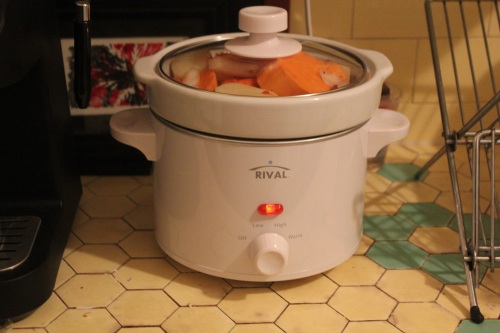
The image size is (500, 333). Identify the location of cover. (272, 72).